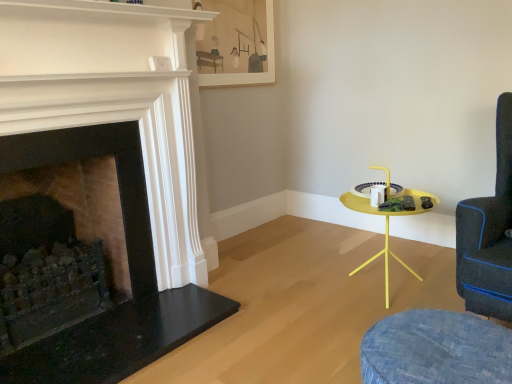
Measure the distance between point (266, 71) and camera.

Point (266, 71) and camera are 3.23 meters apart.

What is the approximate width of matte wooden picture frame at upper center?

The width of matte wooden picture frame at upper center is 1.91 inches.

Identify the location of denim swivel chair at lower right, acting as the second swivel chair starting from the right. (436, 349).

Based on the photo, how much space does matte black fireplace at left, marked as the first fireplace in a right-to-left arrangement, occupy horizontally?

The width of matte black fireplace at left, marked as the first fireplace in a right-to-left arrangement, is 7.10 inches.

I want to click on dark blue fabric swivel chair at right, which is the second swivel chair from left to right, so click(436, 349).

Measure the distance between point (88, 268) and camera.

The depth of point (88, 268) is 2.12 meters.

Identify the location of matte wooden picture frame at upper center. (237, 43).

Considering the relative positions of matte wooden picture frame at upper center and dark blue fabric swivel chair at right, the first swivel chair in the right-to-left sequence, in the image provided, is matte wooden picture frame at upper center to the left or to the right of dark blue fabric swivel chair at right, the first swivel chair in the right-to-left sequence,?

Clearly, matte wooden picture frame at upper center is on the left of dark blue fabric swivel chair at right, the first swivel chair in the right-to-left sequence, in the image.

Considering the points (267, 50) and (474, 279), which point is behind, point (267, 50) or point (474, 279)?

Point (267, 50)

From a real-world perspective, which object stands above the other?

From a 3D spatial view, matte wooden picture frame at upper center is above.

Is matte wooden picture frame at upper center shorter than yellow matte side table at right?

Yes.

Considering the relative sizes of matte wooden picture frame at upper center and yellow matte side table at right in the image provided, is matte wooden picture frame at upper center wider than yellow matte side table at right?

No.

Based on the photo, from the image's perspective, is matte wooden picture frame at upper center above or below yellow matte side table at right?

matte wooden picture frame at upper center is above yellow matte side table at right.

Which of these two, matte black fireplace at left, marked as the first fireplace in a right-to-left arrangement, or dark stone fireplace at left, acting as the second fireplace starting from the right, is smaller?

Smaller between the two is matte black fireplace at left, marked as the first fireplace in a right-to-left arrangement.

Does matte black fireplace at left, marked as the first fireplace in a right-to-left arrangement, have a lesser width compared to dark stone fireplace at left, acting as the second fireplace starting from the right?

Yes.

Does matte black fireplace at left, marked as the first fireplace in a right-to-left arrangement, turn towards dark stone fireplace at left, acting as the second fireplace starting from the right?

Yes, matte black fireplace at left, marked as the first fireplace in a right-to-left arrangement, is oriented towards dark stone fireplace at left, acting as the second fireplace starting from the right.

Consider the image. Is dark stone fireplace at left, marked as the first fireplace in a left-to-right arrangement, a part of matte black fireplace at left, which is the 2th fireplace from left to right?

Definitely not — dark stone fireplace at left, marked as the first fireplace in a left-to-right arrangement, is not inside matte black fireplace at left, which is the 2th fireplace from left to right.

Which is more to the left, matte black fireplace at left, which is the 2th fireplace from left to right, or yellow matte side table at right?

From the viewer's perspective, matte black fireplace at left, which is the 2th fireplace from left to right, appears more on the left side.

How different are the orientations of matte black fireplace at left, marked as the first fireplace in a right-to-left arrangement, and yellow matte side table at right in degrees?

There is a 90.9-degree angle between the facing directions of matte black fireplace at left, marked as the first fireplace in a right-to-left arrangement, and yellow matte side table at right.

Locate an element on the screen. table behind the matte black fireplace at left, which is the 2th fireplace from left to right is located at coordinates (x=386, y=226).

Considering the sizes of matte black fireplace at left, which is the 2th fireplace from left to right, and yellow matte side table at right in the image, is matte black fireplace at left, which is the 2th fireplace from left to right, taller or shorter than yellow matte side table at right?

In the image, matte black fireplace at left, which is the 2th fireplace from left to right, appears to be taller than yellow matte side table at right.

How many degrees apart are the facing directions of denim swivel chair at lower right, the 1th swivel chair when ordered from left to right, and matte black fireplace at left, which is the 2th fireplace from left to right?

The facing directions of denim swivel chair at lower right, the 1th swivel chair when ordered from left to right, and matte black fireplace at left, which is the 2th fireplace from left to right, are 90.9 degrees apart.

Considering the sizes of objects denim swivel chair at lower right, acting as the second swivel chair starting from the right, and matte black fireplace at left, marked as the first fireplace in a right-to-left arrangement, in the image provided, who is smaller, denim swivel chair at lower right, acting as the second swivel chair starting from the right, or matte black fireplace at left, marked as the first fireplace in a right-to-left arrangement,?

denim swivel chair at lower right, acting as the second swivel chair starting from the right, is smaller.

From a real-world perspective, is denim swivel chair at lower right, acting as the second swivel chair starting from the right, located beneath matte black fireplace at left, which is the 2th fireplace from left to right?

Indeed, from a real-world perspective, denim swivel chair at lower right, acting as the second swivel chair starting from the right, is positioned beneath matte black fireplace at left, which is the 2th fireplace from left to right.

Which is further, (415, 352) or (190, 132)?

The point (190, 132) is behind.

Which of these two, yellow matte side table at right or matte black fireplace at left, which is the 2th fireplace from left to right, is bigger?

matte black fireplace at left, which is the 2th fireplace from left to right.

From a real-world perspective, which object stands above the other?

From a 3D spatial view, matte black fireplace at left, which is the 2th fireplace from left to right, is above.

Is yellow matte side table at right closer to camera compared to matte black fireplace at left, marked as the first fireplace in a right-to-left arrangement?

That is False.

Would you say dark stone fireplace at left, acting as the second fireplace starting from the right, is inside or outside yellow matte side table at right?

dark stone fireplace at left, acting as the second fireplace starting from the right, cannot be found inside yellow matte side table at right.

Is dark stone fireplace at left, acting as the second fireplace starting from the right, placed right next to yellow matte side table at right?

dark stone fireplace at left, acting as the second fireplace starting from the right, is not next to yellow matte side table at right, and they're not touching.

From a real-world perspective, between dark stone fireplace at left, marked as the first fireplace in a left-to-right arrangement, and yellow matte side table at right, who is vertically higher?

dark stone fireplace at left, marked as the first fireplace in a left-to-right arrangement.

Where is `picture frame located behind the dark blue fabric swivel chair at right, the first swivel chair in the right-to-left sequence`? picture frame located behind the dark blue fabric swivel chair at right, the first swivel chair in the right-to-left sequence is located at coordinates (237, 43).

Where is `picture frame on the left of the yellow matte side table at right`? The image size is (512, 384). picture frame on the left of the yellow matte side table at right is located at coordinates (237, 43).

Based on their spatial positions, is dark stone fireplace at left, acting as the second fireplace starting from the right, or matte wooden picture frame at upper center further from matte black fireplace at left, marked as the first fireplace in a right-to-left arrangement?

matte wooden picture frame at upper center lies further to matte black fireplace at left, marked as the first fireplace in a right-to-left arrangement, than the other object.

Considering their positions, is dark stone fireplace at left, acting as the second fireplace starting from the right, positioned further to matte wooden picture frame at upper center than matte black fireplace at left, marked as the first fireplace in a right-to-left arrangement?

Based on the image, dark stone fireplace at left, acting as the second fireplace starting from the right, appears to be further to matte wooden picture frame at upper center.

Estimate the real-world distances between objects in this image. Which object is closer to matte black fireplace at left, which is the 2th fireplace from left to right, dark blue fabric swivel chair at right, the first swivel chair in the right-to-left sequence, or dark stone fireplace at left, acting as the second fireplace starting from the right?

dark stone fireplace at left, acting as the second fireplace starting from the right, is closer to matte black fireplace at left, which is the 2th fireplace from left to right.

Based on their spatial positions, is matte black fireplace at left, which is the 2th fireplace from left to right, or matte wooden picture frame at upper center further from denim swivel chair at lower right, acting as the second swivel chair starting from the right?

matte wooden picture frame at upper center lies further to denim swivel chair at lower right, acting as the second swivel chair starting from the right, than the other object.

Looking at the image, which one is located further to dark blue fabric swivel chair at right, the first swivel chair in the right-to-left sequence, denim swivel chair at lower right, the 1th swivel chair when ordered from left to right, or yellow matte side table at right?

yellow matte side table at right lies further to dark blue fabric swivel chair at right, the first swivel chair in the right-to-left sequence, than the other object.

From the picture: When comparing their distances from yellow matte side table at right, does matte black fireplace at left, marked as the first fireplace in a right-to-left arrangement, or matte wooden picture frame at upper center seem closer?

matte black fireplace at left, marked as the first fireplace in a right-to-left arrangement, is positioned closer to the anchor yellow matte side table at right.

Estimate the real-world distances between objects in this image. Which object is closer to dark blue fabric swivel chair at right, which is the second swivel chair from left to right, matte wooden picture frame at upper center or denim swivel chair at lower right, the 1th swivel chair when ordered from left to right?

denim swivel chair at lower right, the 1th swivel chair when ordered from left to right, is closer to dark blue fabric swivel chair at right, which is the second swivel chair from left to right.

Considering their positions, is yellow matte side table at right positioned closer to denim swivel chair at lower right, acting as the second swivel chair starting from the right, than matte black fireplace at left, which is the 2th fireplace from left to right?

The object closer to denim swivel chair at lower right, acting as the second swivel chair starting from the right, is yellow matte side table at right.

Where is `fireplace between dark stone fireplace at left, acting as the second fireplace starting from the right, and dark blue fabric swivel chair at right, which is the second swivel chair from left to right`? The height and width of the screenshot is (384, 512). fireplace between dark stone fireplace at left, acting as the second fireplace starting from the right, and dark blue fabric swivel chair at right, which is the second swivel chair from left to right is located at coordinates (116, 167).

Find the location of `table that lies between matte wooden picture frame at upper center and denim swivel chair at lower right, the 1th swivel chair when ordered from left to right, from top to bottom`. table that lies between matte wooden picture frame at upper center and denim swivel chair at lower right, the 1th swivel chair when ordered from left to right, from top to bottom is located at coordinates click(386, 226).

At what (x,y) coordinates should I click in order to perform the action: click on swivel chair between dark stone fireplace at left, marked as the first fireplace in a left-to-right arrangement, and dark blue fabric swivel chair at right, the first swivel chair in the right-to-left sequence. Please return your answer as a coordinate pair (x, y). Looking at the image, I should click on coord(436,349).

At what (x,y) coordinates should I click in order to perform the action: click on swivel chair situated between dark stone fireplace at left, marked as the first fireplace in a left-to-right arrangement, and yellow matte side table at right from left to right. Please return your answer as a coordinate pair (x, y). The image size is (512, 384). Looking at the image, I should click on (436, 349).